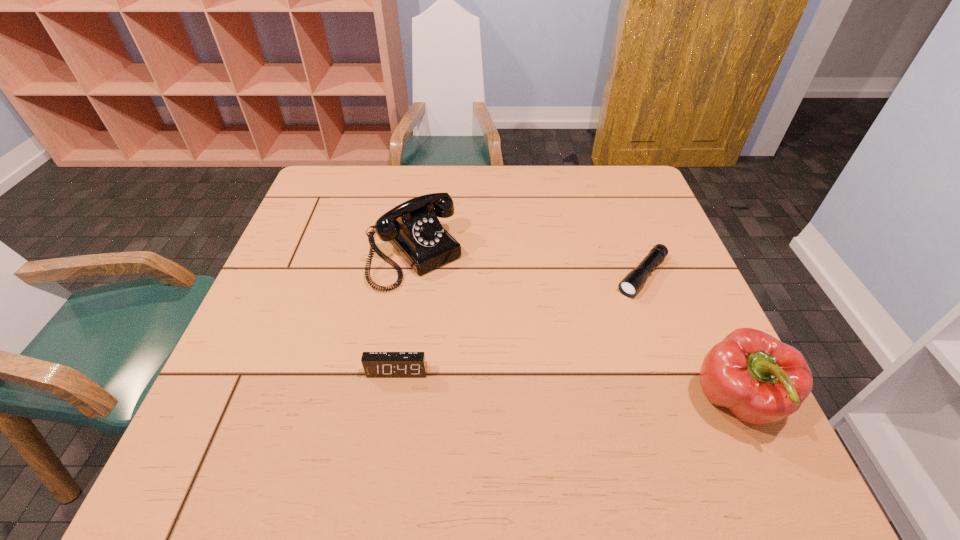
Identify the location of alarm clock. This screenshot has width=960, height=540. (376, 364).

Find the location of a particular element. pepper is located at coordinates (761, 380).

The width and height of the screenshot is (960, 540). In order to click on telephone in this screenshot , I will do `click(413, 228)`.

The image size is (960, 540). I want to click on the shortest object, so click(x=630, y=285).

Where is `vacant space located 0.060m on the front-facing side of the third tallest object`? vacant space located 0.060m on the front-facing side of the third tallest object is located at coordinates (392, 405).

Locate an element on the screen. The height and width of the screenshot is (540, 960). vacant space located 0.160m on the left of the pepper is located at coordinates (609, 402).

Image resolution: width=960 pixels, height=540 pixels. Find the location of `vacant space located on the dial of the telephone`. vacant space located on the dial of the telephone is located at coordinates pyautogui.click(x=454, y=303).

Image resolution: width=960 pixels, height=540 pixels. Find the location of `free space located 0.090m on the dial of the telephone`. free space located 0.090m on the dial of the telephone is located at coordinates (459, 308).

Find the location of a particular element. The image size is (960, 540). free region located 0.150m on the dial of the telephone is located at coordinates (473, 325).

You are a GUI agent. You are given a task and a screenshot of the screen. Output one action in this format:
    pyautogui.click(x=<x>, y=<y>)
    Task: Click on the vacant space located at the lens end of the shortest object
    This screenshot has height=540, width=960.
    Given the screenshot: What is the action you would take?
    tap(588, 341)